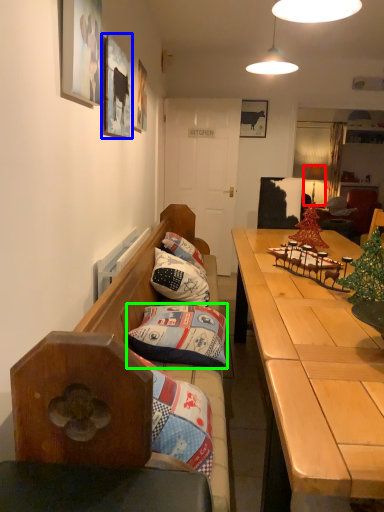
Question: Which is farther away from lamp (highlighted by a red box)? picture frame (highlighted by a blue box) or pillow (highlighted by a green box)?

Choices:
 (A) picture frame
 (B) pillow

Answer: (B)